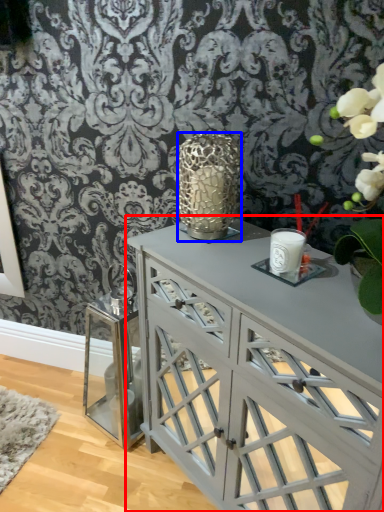
Question: Among these objects, which one is farthest to the camera, table (highlighted by a red box) or candle holder (highlighted by a blue box)?

Choices:
 (A) table
 (B) candle holder

Answer: (B)